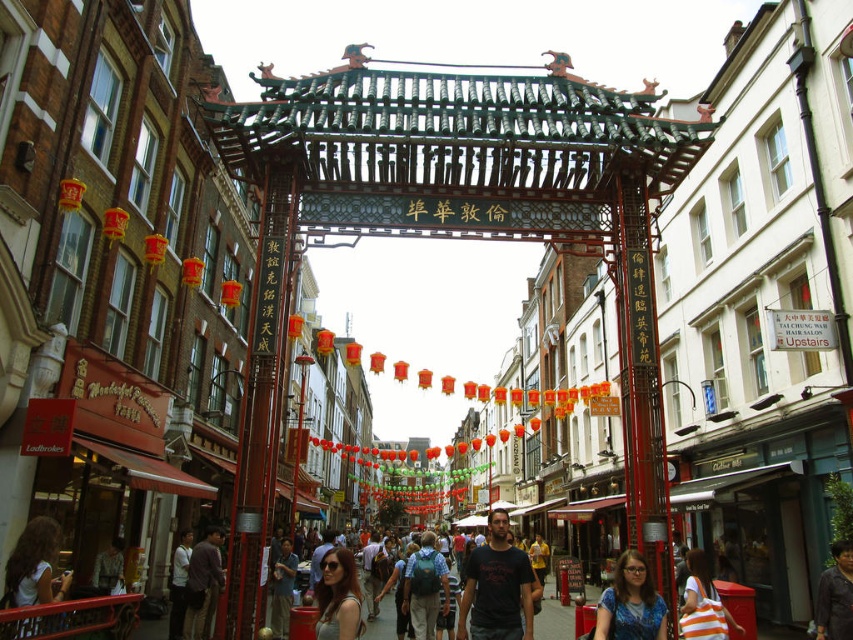
Question: Can you confirm if matte gray tank top at center is positioned to the left of dark brown leather jacket at lower left?

Choices:
 (A) no
 (B) yes

Answer: (A)

Question: Which object appears farthest from the camera in this image?

Choices:
 (A) dark brown leather jacket at center
 (B) matte black backpack at center
 (C) orange striped bag at center

Answer: (B)

Question: Is blue printed shirt at center thinner than white shirt at lower left?

Choices:
 (A) yes
 (B) no

Answer: (A)

Question: Is matte gray tank top at center to the left of dark brown leather jacket at lower left from the viewer's perspective?

Choices:
 (A) yes
 (B) no

Answer: (B)

Question: Which point appears closest to the camera in this image?

Choices:
 (A) (512, 624)
 (B) (192, 566)

Answer: (A)

Question: Which object is positioned farthest from the matte white shirt at lower left?

Choices:
 (A) dark blue t-shirt at center
 (B) blue printed shirt at center

Answer: (B)